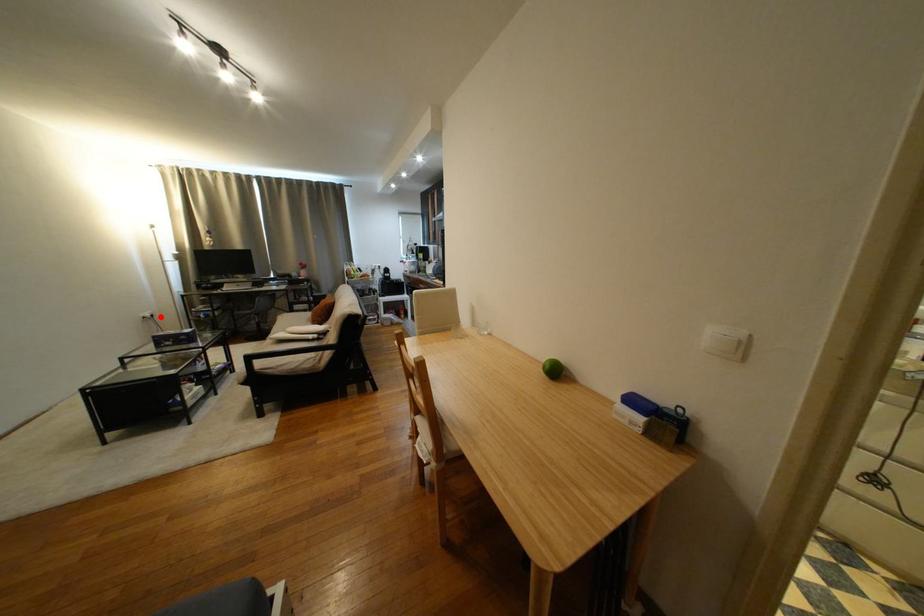
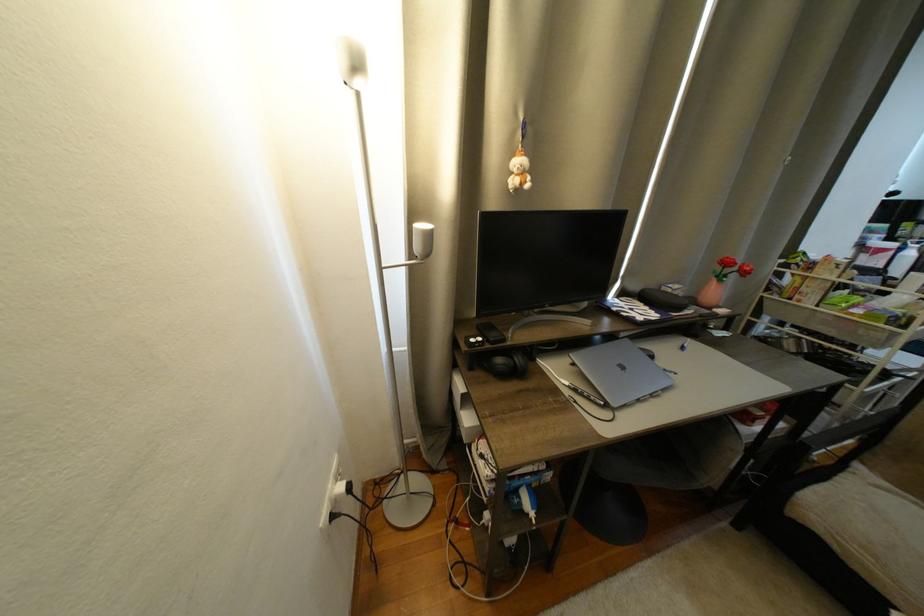
Question: I am providing you with two images of the same scene from different viewpoints. A red point is shown in image1. For the corresponding object point in image2, is it positioned nearer or farther from the camera?

Choices:
 (A) Nearer
 (B) Farther

Answer: (A)